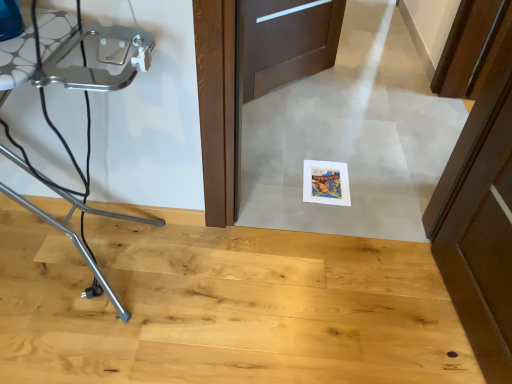
This screenshot has width=512, height=384. What do you see at coordinates (87, 125) in the screenshot?
I see `metallic silver tripod at left` at bounding box center [87, 125].

Find the location of a particular element. This screenshot has height=384, width=512. metallic silver tripod at left is located at coordinates (87, 125).

Identify the location of metallic silver tripod at left. (87, 125).